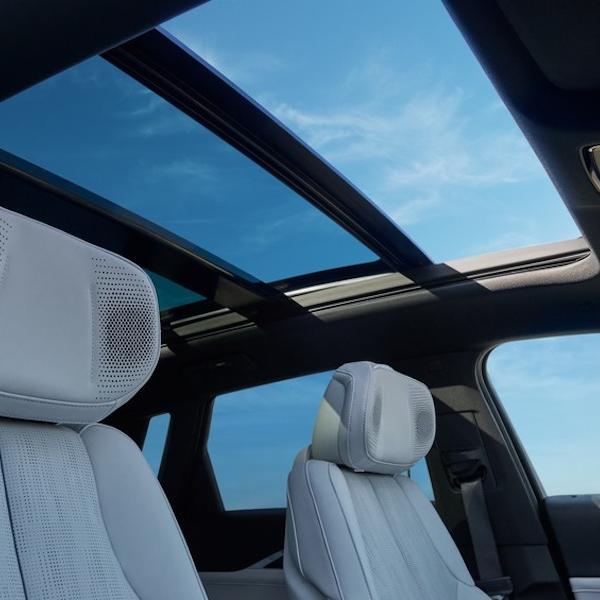
This screenshot has width=600, height=600. I want to click on window, so click(x=235, y=421).